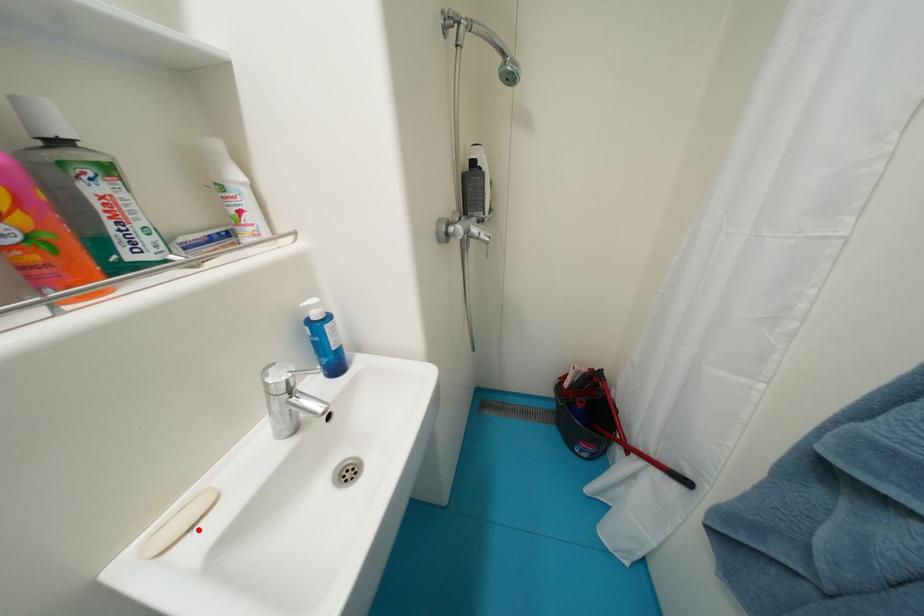
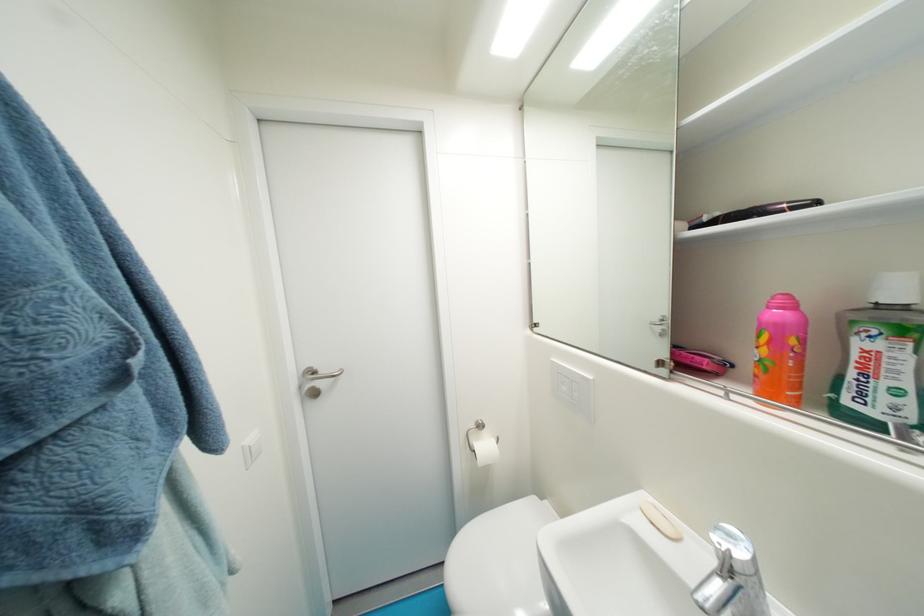
In the second image, find the point that corresponds to the highlighted location in the first image.

(659, 525)